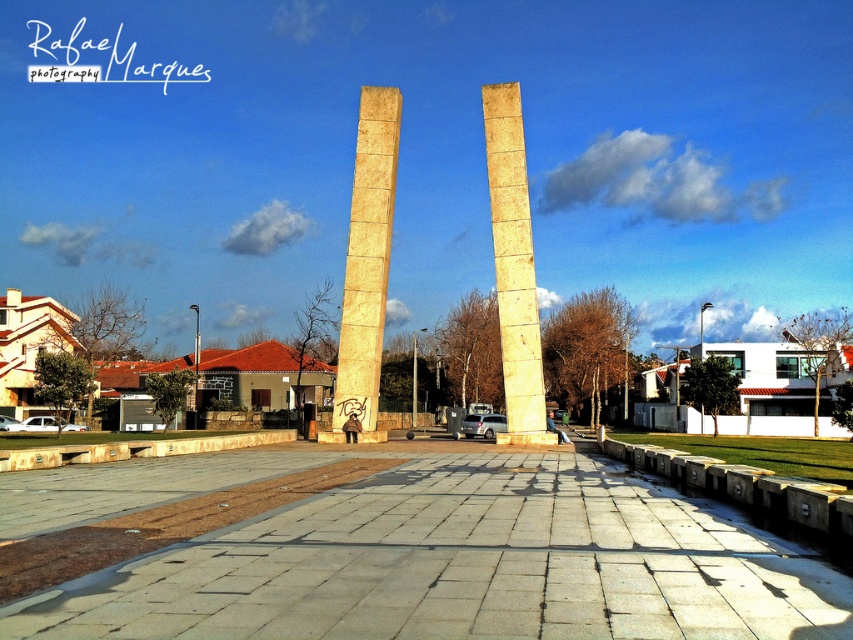
Question: In this image, where is yellow stone column at center located relative to yellow marble pillar at center?

Choices:
 (A) below
 (B) above

Answer: (A)

Question: Can you confirm if yellow stone column at center is positioned to the right of yellow marble pillar at center?

Choices:
 (A) yes
 (B) no

Answer: (B)

Question: Which object is closer to the camera taking this photo?

Choices:
 (A) yellow marble pillar at center
 (B) yellow stone column at center

Answer: (A)

Question: Among these points, which one is nearest to the camera?

Choices:
 (A) (502, 284)
 (B) (381, 161)

Answer: (A)

Question: Can you confirm if yellow stone column at center is positioned to the left of yellow marble pillar at center?

Choices:
 (A) no
 (B) yes

Answer: (B)

Question: Among these points, which one is farthest from the camera?

Choices:
 (A) (498, 243)
 (B) (357, 211)

Answer: (B)